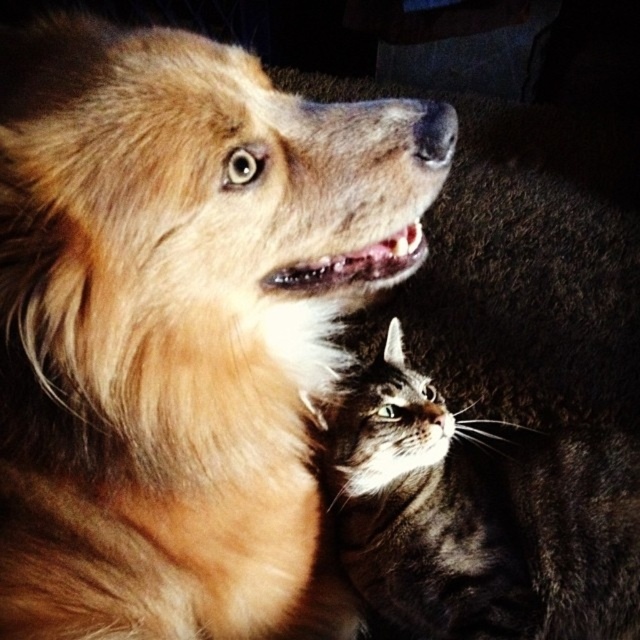
Question: Is golden fur dog at upper left smaller than tabby fur cat at center?

Choices:
 (A) yes
 (B) no

Answer: (B)

Question: Can you confirm if golden fur dog at upper left is positioned below tabby fur cat at center?

Choices:
 (A) no
 (B) yes

Answer: (A)

Question: Is golden fur dog at upper left further to the viewer compared to tabby fur cat at center?

Choices:
 (A) yes
 (B) no

Answer: (B)

Question: Which point is farther from the camera taking this photo?

Choices:
 (A) (496, 465)
 (B) (417, 144)

Answer: (A)

Question: Which of the following is the closest to the observer?

Choices:
 (A) [97, 20]
 (B) [428, 604]

Answer: (A)